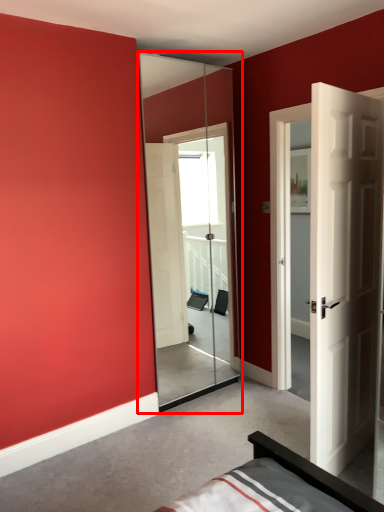
Question: From the image's perspective, where is screen door (annotated by the red box) located relative to door?

Choices:
 (A) below
 (B) above

Answer: (B)